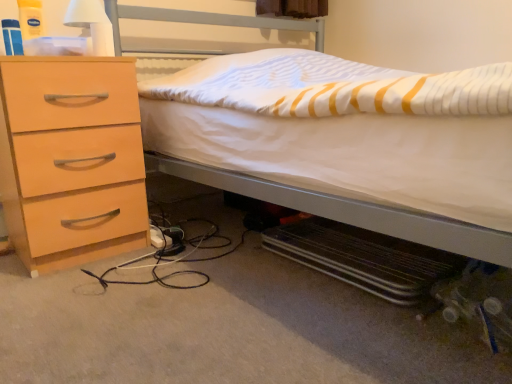
At what (x,y) coordinates should I click in order to perform the action: click on light wood/finish chest of drawers at left. Please return your answer as a coordinate pair (x, y). This screenshot has height=384, width=512. Looking at the image, I should click on (70, 158).

Locate an element on the screen. The height and width of the screenshot is (384, 512). white matte lampshade at upper left is located at coordinates (x=92, y=24).

From a real-world perspective, is white matte lampshade at upper left positioned above or below white matte bed at center?

white matte lampshade at upper left is situated higher than white matte bed at center in the real world.

Does point (104, 32) come behind point (352, 201)?

Yes, point (104, 32) is behind point (352, 201).

Is white matte lampshade at upper left turned away from white matte bed at center?

No.

Between white matte lampshade at upper left and white matte bed at center, which one is positioned in front?

white matte bed at center.

Is white matte lampshade at upper left taller than light wood/finish chest of drawers at left?

Incorrect, the height of white matte lampshade at upper left is not larger of that of light wood/finish chest of drawers at left.

Looking at this image, from a real-world perspective, is white matte lampshade at upper left below light wood/finish chest of drawers at left?

No, from a real-world perspective, white matte lampshade at upper left is not beneath light wood/finish chest of drawers at left.

Is white matte lampshade at upper left to the right of light wood/finish chest of drawers at left from the viewer's perspective?

Correct, you'll find white matte lampshade at upper left to the right of light wood/finish chest of drawers at left.

Which is closer to the camera, (x=98, y=2) or (x=94, y=199)?

Point (x=98, y=2).

From the image's perspective, is light wood/finish chest of drawers at left over white matte bed at center?

No, from the image's perspective, light wood/finish chest of drawers at left is not over white matte bed at center.

At what (x,y) coordinates should I click in order to perform the action: click on bed above the light wood/finish chest of drawers at left (from a real-world perspective). Please return your answer as a coordinate pair (x, y). This screenshot has height=384, width=512. Looking at the image, I should click on (354, 212).

What's the angular difference between light wood/finish chest of drawers at left and white matte bed at center's facing directions?

0.412 degrees.

Does light wood/finish chest of drawers at left contain white matte bed at center?

No, white matte bed at center is not a part of light wood/finish chest of drawers at left.

Looking at this image, between white matte bed at center and white matte lampshade at upper left, which one has smaller size?

With smaller size is white matte lampshade at upper left.

Does white matte bed at center come behind white matte lampshade at upper left?

That is False.

Identify the location of bed that appears below the white matte lampshade at upper left (from the image's perspective). [354, 212].

Considering the sizes of white matte bed at center and white matte lampshade at upper left in the image, is white matte bed at center wider or thinner than white matte lampshade at upper left?

Considering their sizes, white matte bed at center looks broader than white matte lampshade at upper left.

From the image's perspective, which is above, light wood/finish chest of drawers at left or white matte lampshade at upper left?

white matte lampshade at upper left is shown above in the image.

From the picture: Is light wood/finish chest of drawers at left looking in the opposite direction of white matte lampshade at upper left?

light wood/finish chest of drawers at left does not have its back to white matte lampshade at upper left.

Would you consider light wood/finish chest of drawers at left to be distant from white matte lampshade at upper left?

light wood/finish chest of drawers at left is near white matte lampshade at upper left, not far away.

I want to click on the chest of drawers beneath the white matte lampshade at upper left (from a real-world perspective), so click(x=70, y=158).

Is white matte bed at center thinner than light wood/finish chest of drawers at left?

No, white matte bed at center is not thinner than light wood/finish chest of drawers at left.

Which is behind, white matte bed at center or light wood/finish chest of drawers at left?

light wood/finish chest of drawers at left is further from the camera.

Would you say white matte bed at center is to the left or to the right of light wood/finish chest of drawers at left in the picture?

In the image, white matte bed at center appears on the right side of light wood/finish chest of drawers at left.

Is point (202, 21) closer or farther from the camera than point (113, 161)?

Point (202, 21).

The width and height of the screenshot is (512, 384). Find the location of `bed to the right of white matte lampshade at upper left`. bed to the right of white matte lampshade at upper left is located at coordinates (354, 212).

At what (x,y) coordinates should I click in order to perform the action: click on bedside lamp above the light wood/finish chest of drawers at left (from the image's perspective). Please return your answer as a coordinate pair (x, y). The height and width of the screenshot is (384, 512). Looking at the image, I should click on (92, 24).

Which object lies further to the anchor point white matte lampshade at upper left, light wood/finish chest of drawers at left or white matte bed at center?

white matte bed at center is positioned further to the anchor white matte lampshade at upper left.

From the image, which object appears to be farther from white matte lampshade at upper left, white matte bed at center or light wood/finish chest of drawers at left?

white matte bed at center is positioned further to the anchor white matte lampshade at upper left.

Considering their positions, is light wood/finish chest of drawers at left positioned further to white matte bed at center than white matte lampshade at upper left?

white matte lampshade at upper left.

From the image, which object appears to be farther from white matte bed at center, white matte lampshade at upper left or light wood/finish chest of drawers at left?

Based on the image, white matte lampshade at upper left appears to be further to white matte bed at center.

When comparing their distances from light wood/finish chest of drawers at left, does white matte bed at center or white matte lampshade at upper left seem closer?

The object closer to light wood/finish chest of drawers at left is white matte lampshade at upper left.

When comparing their distances from light wood/finish chest of drawers at left, does white matte lampshade at upper left or white matte bed at center seem further?

white matte bed at center.

At what (x,y) coordinates should I click in order to perform the action: click on bedside lamp situated between light wood/finish chest of drawers at left and white matte bed at center from left to right. Please return your answer as a coordinate pair (x, y). The width and height of the screenshot is (512, 384). Looking at the image, I should click on (92, 24).